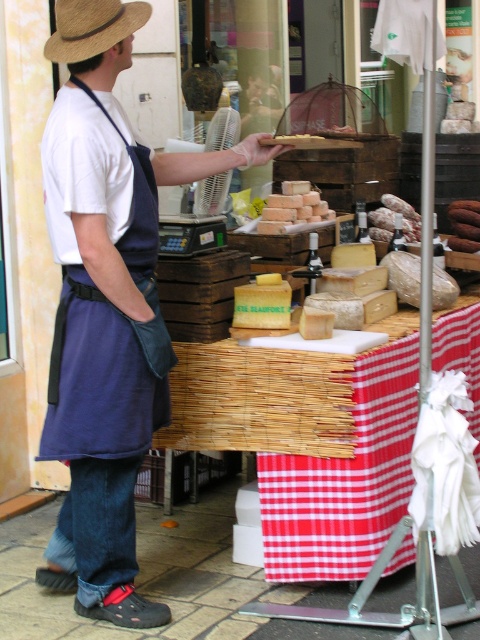
Between red checkered tablecloth at center and yellow cheese at center, which one has more height?

Standing taller between the two is red checkered tablecloth at center.

What do you see at coordinates (346, 480) in the screenshot? I see `red checkered tablecloth at center` at bounding box center [346, 480].

At what (x,y) coordinates should I click in order to perform the action: click on red checkered tablecloth at center. Please return your answer as a coordinate pair (x, y). Looking at the image, I should click on (346, 480).

Who is positioned more to the left, semi-translucent plastic baguette at center or smooth brown bread at center?

Positioned to the left is semi-translucent plastic baguette at center.

Is point (411, 230) behind point (468, 202)?

No, (411, 230) is in front of (468, 202).

In the scene shown: Who is more forward, (377,208) or (463,234)?

Point (463,234) is in front.

The height and width of the screenshot is (640, 480). What are the coordinates of `semi-translucent plastic baguette at center` in the screenshot? It's located at (394, 220).

Does yellow cheese at center have a greater height compared to smooth brown bread at center?

Incorrect, yellow cheese at center's height is not larger of smooth brown bread at center's.

Can you confirm if yellow cheese at center is thinner than smooth brown bread at center?

Incorrect, yellow cheese at center's width is not less than smooth brown bread at center's.

Describe the element at coordinates (263, 304) in the screenshot. Image resolution: width=480 pixels, height=640 pixels. I see `yellow cheese at center` at that location.

At what (x,y) coordinates should I click in order to perform the action: click on yellow cheese at center. Please return your answer as a coordinate pair (x, y). Image resolution: width=480 pixels, height=640 pixels. Looking at the image, I should click on (263, 304).